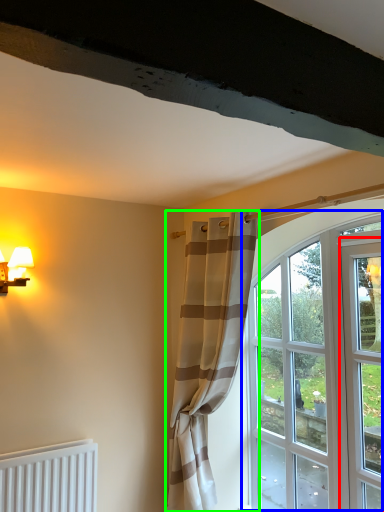
Question: Based on their relative distances, which object is nearer to screen door (highlighted by a red box)? Choose from window (highlighted by a blue box) and curtain (highlighted by a green box).

Choices:
 (A) window
 (B) curtain

Answer: (A)